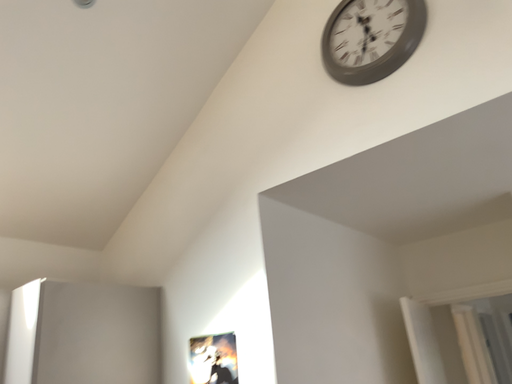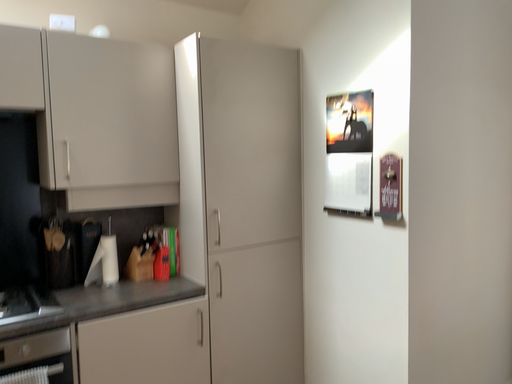
Question: Which way did the camera rotate in the video?

Choices:
 (A) rotated upward
 (B) rotated downward

Answer: (B)